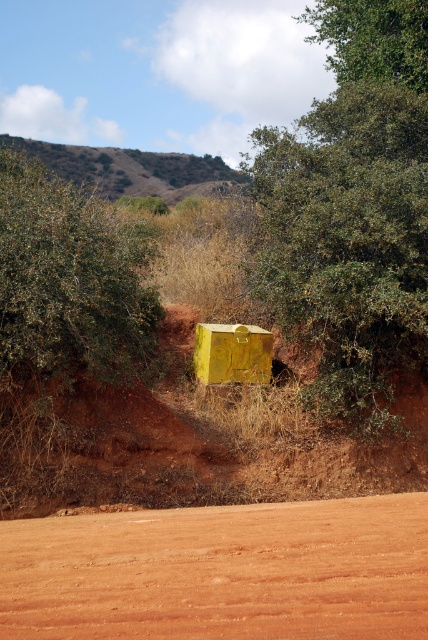
You are standing on the brown sandy dirt at lower center and want to walk to the green leafy tree at upper center. Which direction should you head?

You should head upwards because the green leafy tree at upper center is further away from you than the brown sandy dirt at lower center, which you are currently standing on.

Looking at this image, you are a hiker standing on the dirt path and want to take a photo of both the green leafy tree at center and the green leafy bush at left. Which object would you need to frame more tightly in your camera to capture its full size?

The green leafy tree at center occupies less space than the green leafy bush at left, so you would need to frame the green leafy bush at left more tightly to capture its full size.